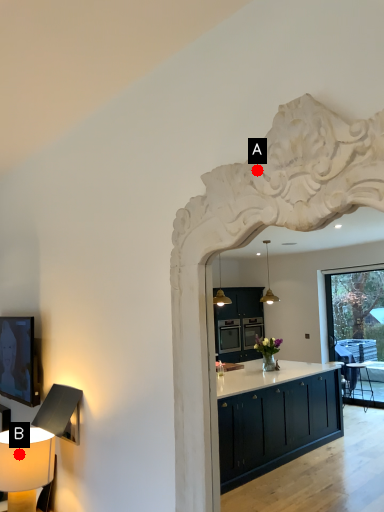
Question: Two points are circled on the image, labeled by A and B beside each circle. Which point is farther to the camera?

Choices:
 (A) A is further
 (B) B is further

Answer: (B)